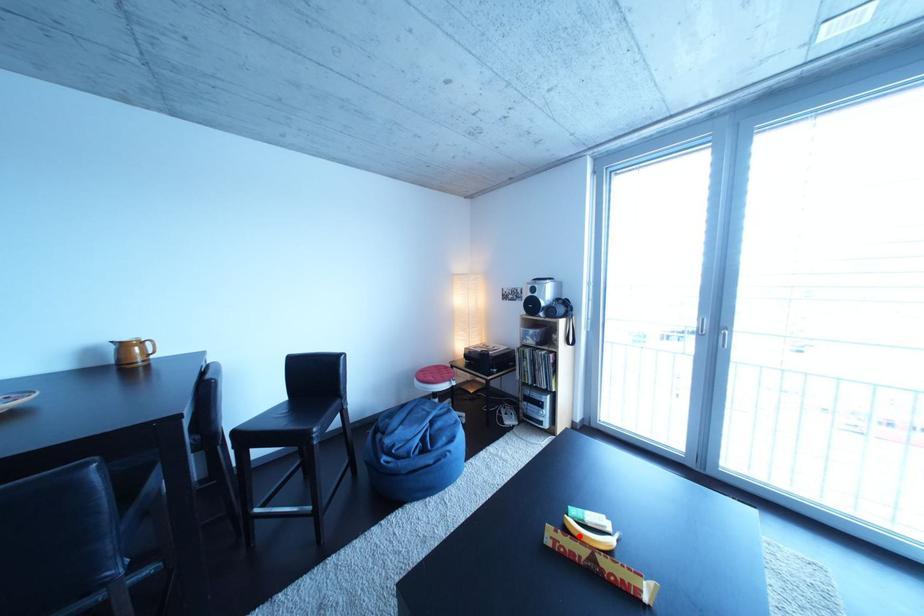
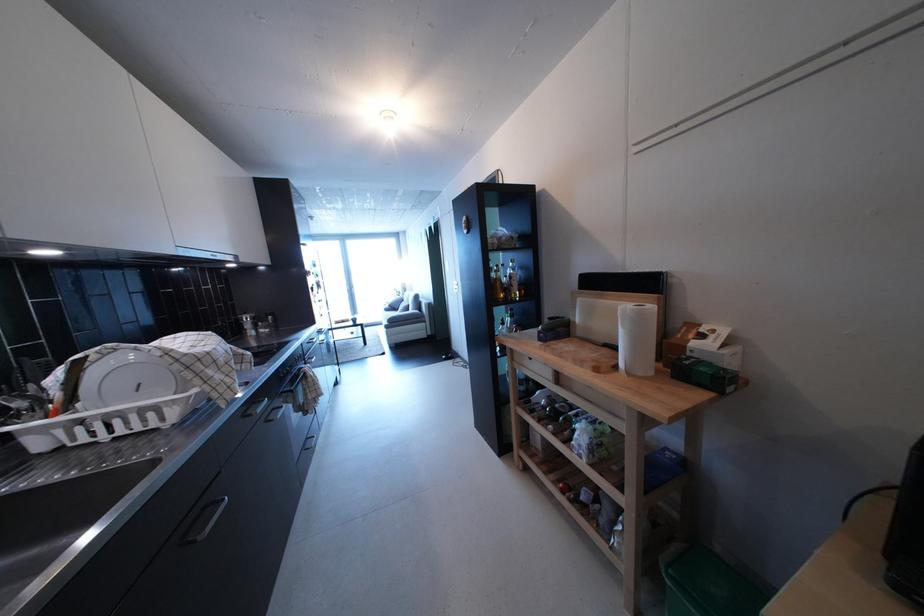
Question: I am providing you with two images of the same scene from different viewpoints. A red point is marked on the first image. Is the red point's position out of view in image 2?

Choices:
 (A) Yes
 (B) No

Answer: (A)